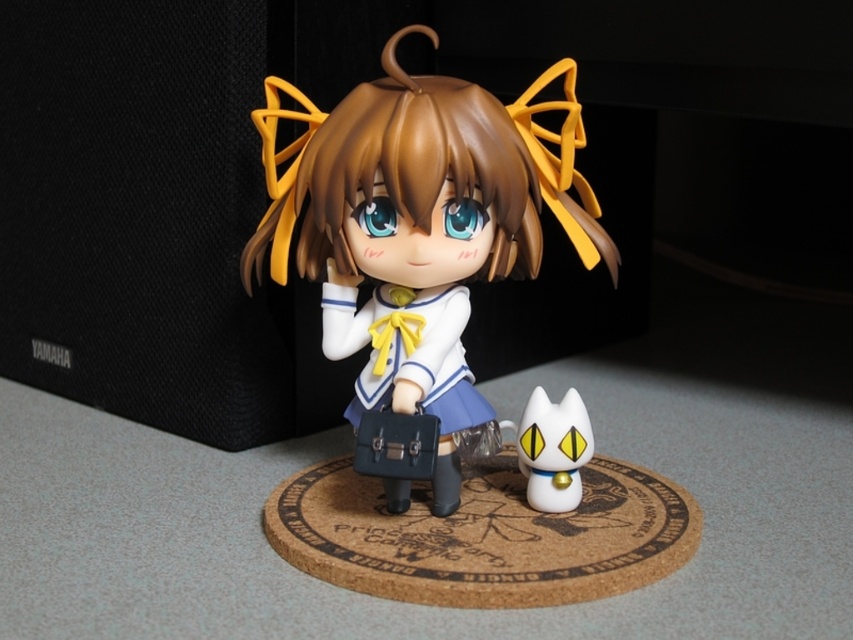
Question: Observing the image, what is the correct spatial positioning of satin white doll at center in reference to white glossy cat at lower right?

Choices:
 (A) right
 (B) left

Answer: (B)

Question: Can you confirm if satin white doll at center is positioned above white glossy cat at lower right?

Choices:
 (A) no
 (B) yes

Answer: (B)

Question: Can you confirm if satin white doll at center is positioned to the left of white glossy cat at lower right?

Choices:
 (A) no
 (B) yes

Answer: (B)

Question: Which of the following is the farthest from the observer?

Choices:
 (A) white glossy cat at lower right
 (B) satin white doll at center

Answer: (A)